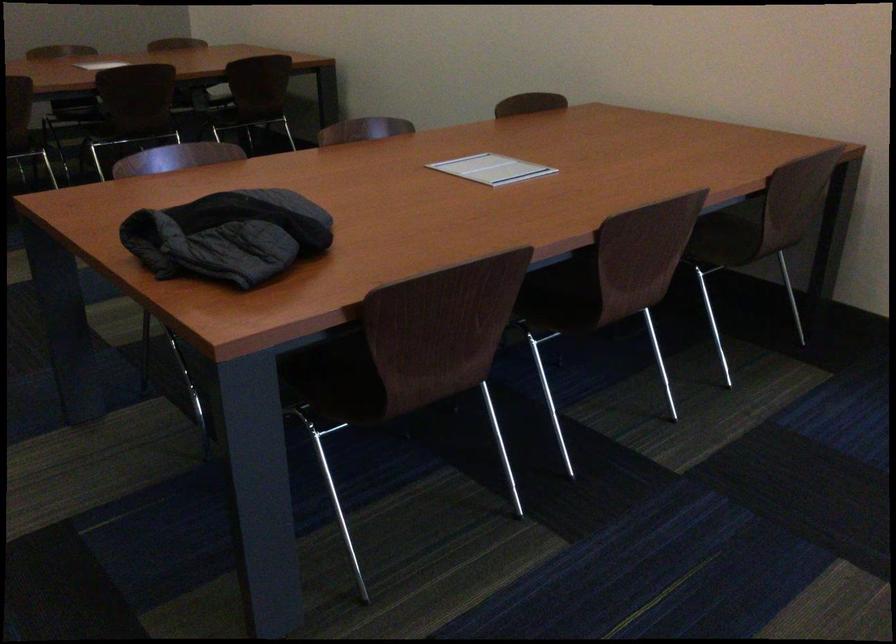
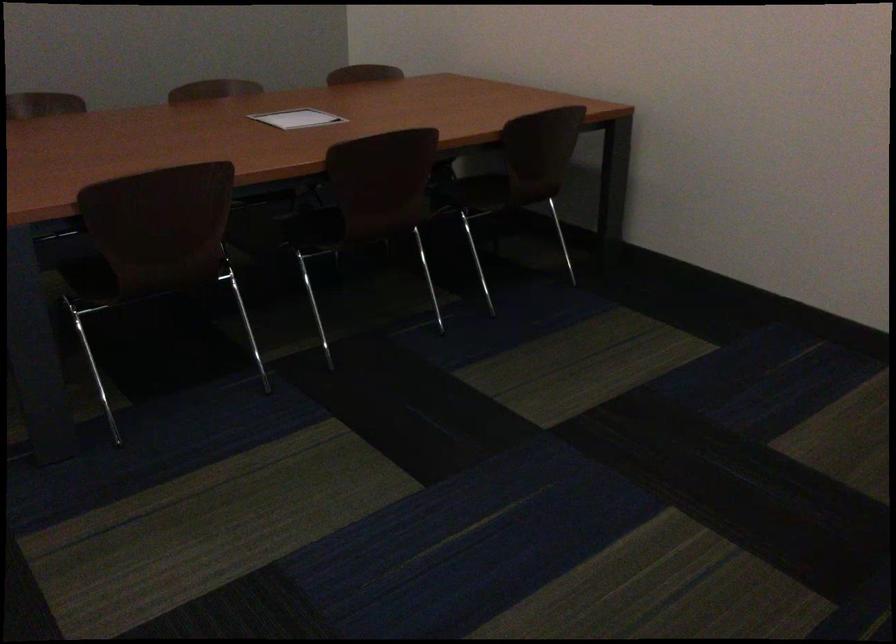
Which direction would the cameraman need to move to produce the second image?

The cameraman moved toward left, forward.